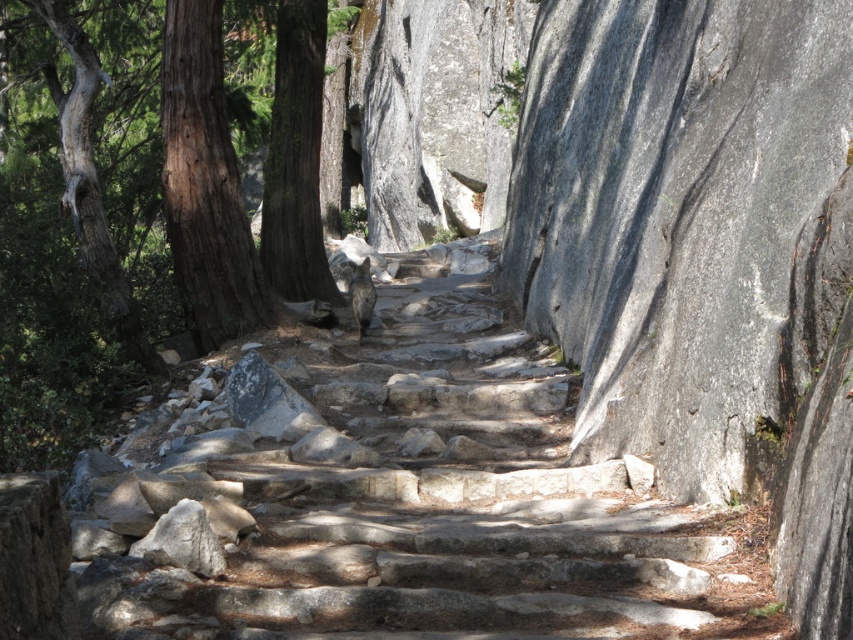
You are a hiker trying to determine which tree has a thicker trunk between the brown rough bark tree at left and the gray textured bark tree at left. Based on their appearance, which one do you think is wider?

The brown rough bark tree at left might be wider than the gray textured bark tree at left, so it is likely the thicker one.

You are a hiker standing on the stone pathway and want to identify the trees on your left. Which tree has a larger size between the brown rough bark tree at left and the gray textured bark tree at left?

The brown rough bark tree at left is bigger than the gray textured bark tree at left.